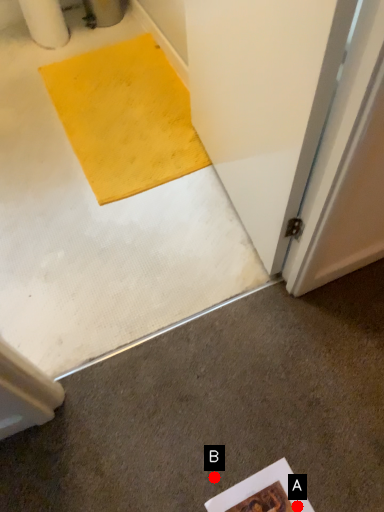
Question: Two points are circled on the image, labeled by A and B beside each circle. Which of the following is the farthest from the observer?

Choices:
 (A) A is further
 (B) B is further

Answer: (B)